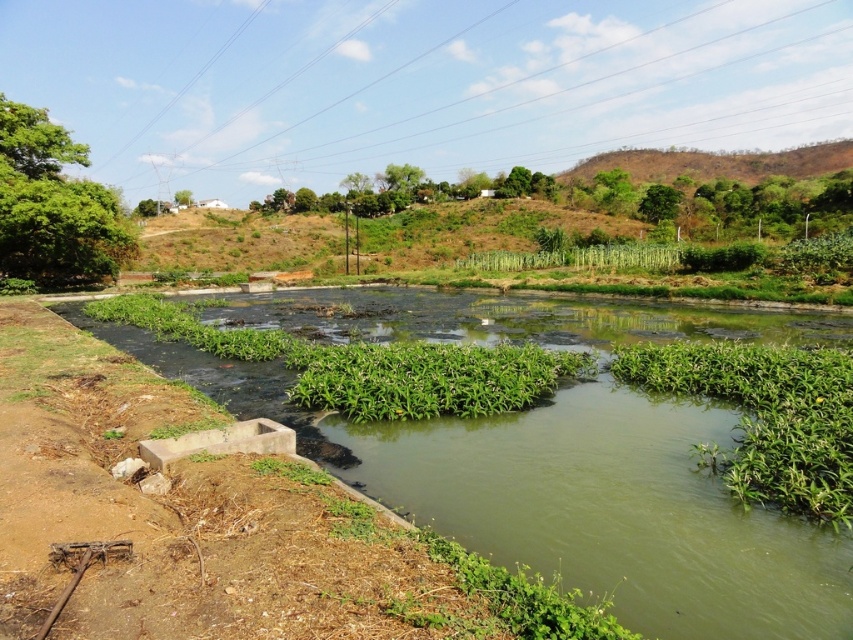
Question: Which point is closer to the camera?

Choices:
 (A) (352, 122)
 (B) (107, 237)
 (C) (746, 172)

Answer: (B)

Question: Which point is closer to the camera?

Choices:
 (A) (637, 152)
 (B) (358, 125)

Answer: (A)

Question: Is clear plastic power lines at upper center bigger than brown dry grass at upper right?

Choices:
 (A) yes
 (B) no

Answer: (A)

Question: From the image, what is the correct spatial relationship of green leafy tree at left in relation to brown dry grass at upper right?

Choices:
 (A) left
 (B) right

Answer: (A)

Question: Which point appears farthest from the camera in this image?

Choices:
 (A) (125, 230)
 (B) (360, 112)
 (C) (570, 177)

Answer: (B)

Question: Can you confirm if clear plastic power lines at upper center is positioned to the right of green leafy tree at left?

Choices:
 (A) yes
 (B) no

Answer: (A)